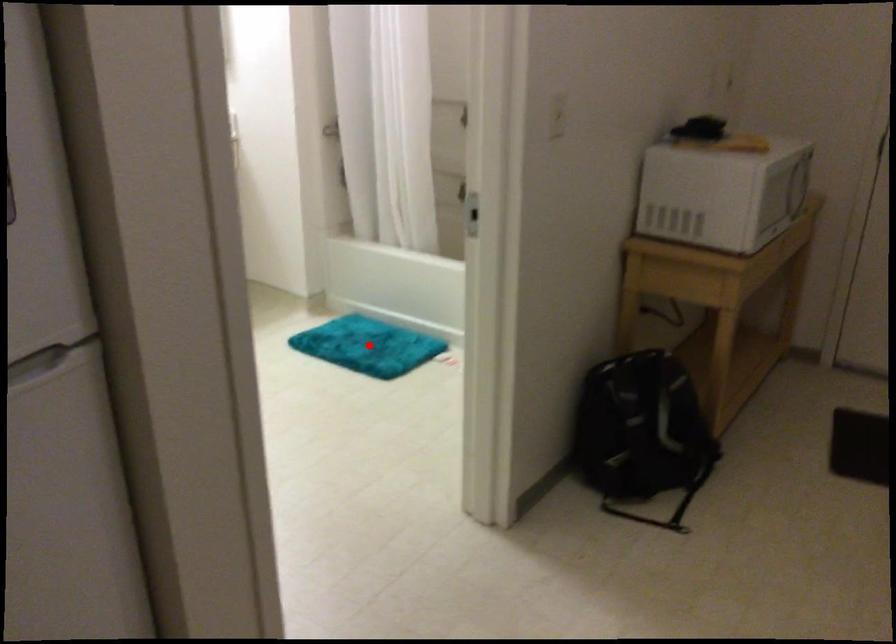
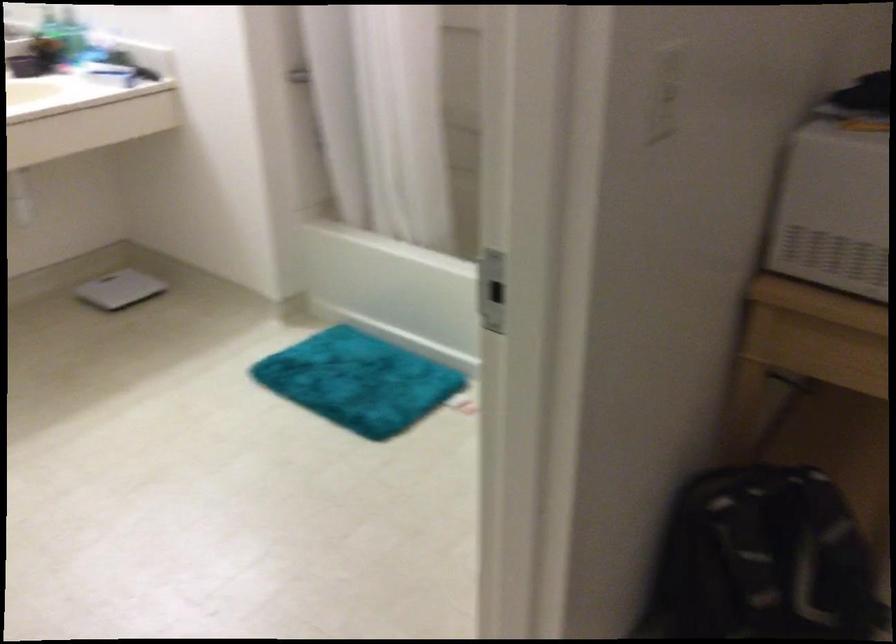
Question: I am providing you with two images of the same scene from different viewpoints. In image1, a red point is highlighted. Considering the same 3D point in image2, which of the following is correct?

Choices:
 (A) It is closer
 (B) It is farther

Answer: (A)